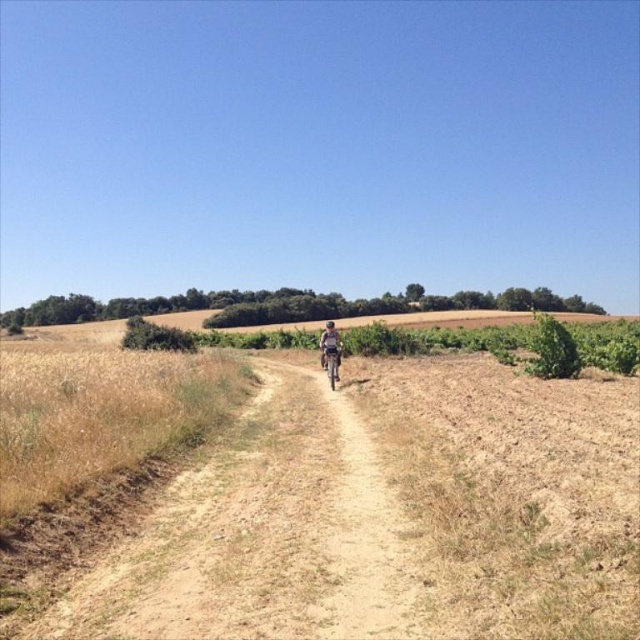
This screenshot has width=640, height=640. I want to click on camouflage fabric cyclist at center, so click(x=330, y=344).

Find the location of a particular element. The image size is (640, 640). camouflage fabric cyclist at center is located at coordinates (330, 344).